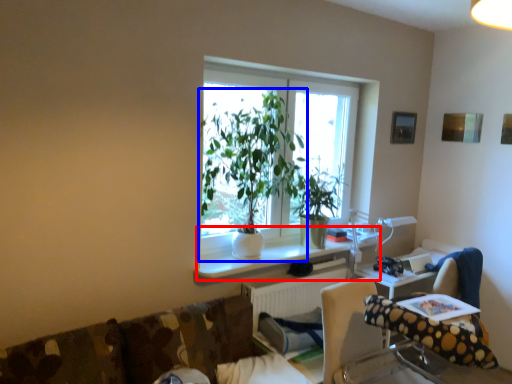
Question: Which object is closer to the camera taking this photo, computer desk (highlighted by a red box) or houseplant (highlighted by a blue box)?

Choices:
 (A) computer desk
 (B) houseplant

Answer: (B)